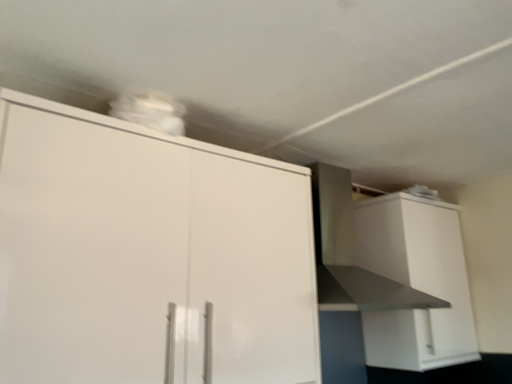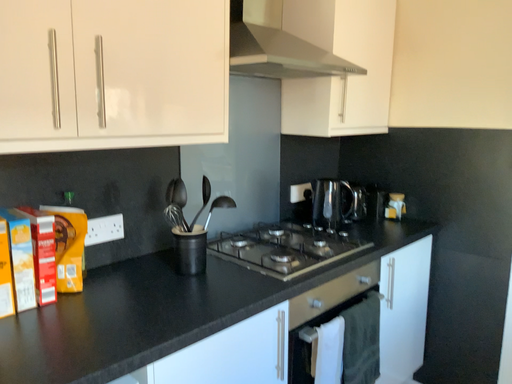
Question: How did the camera likely rotate when shooting the video?

Choices:
 (A) rotated left
 (B) rotated right

Answer: (B)